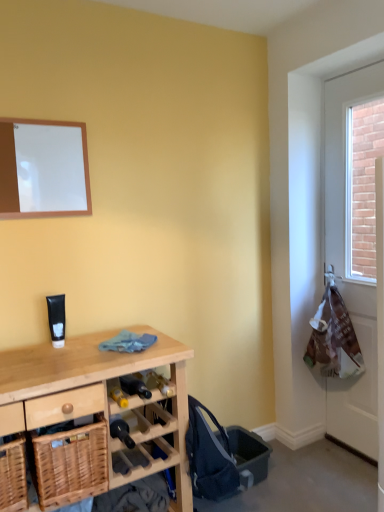
Where is `free location above wooden desk at lower left (from a real-world perspective)`? free location above wooden desk at lower left (from a real-world perspective) is located at coordinates (78, 355).